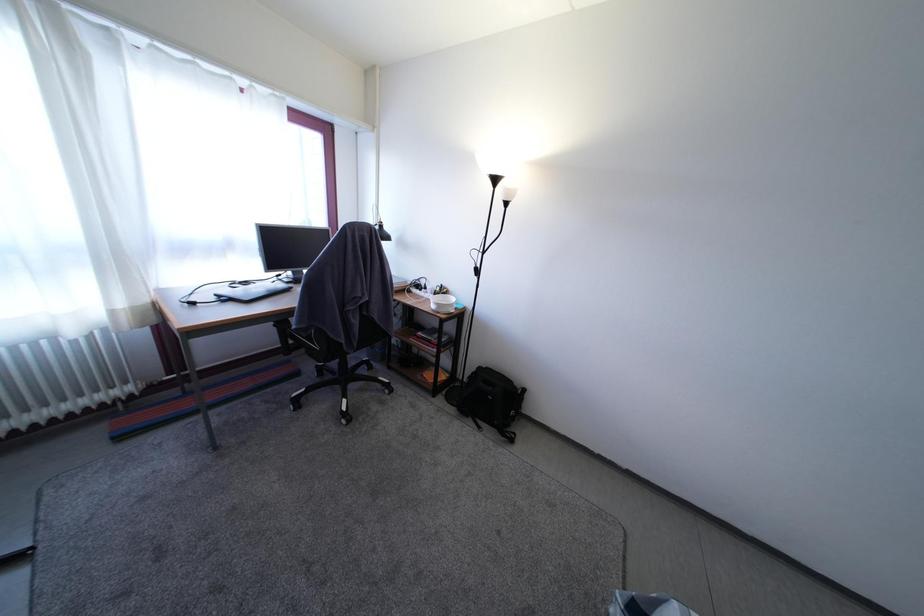
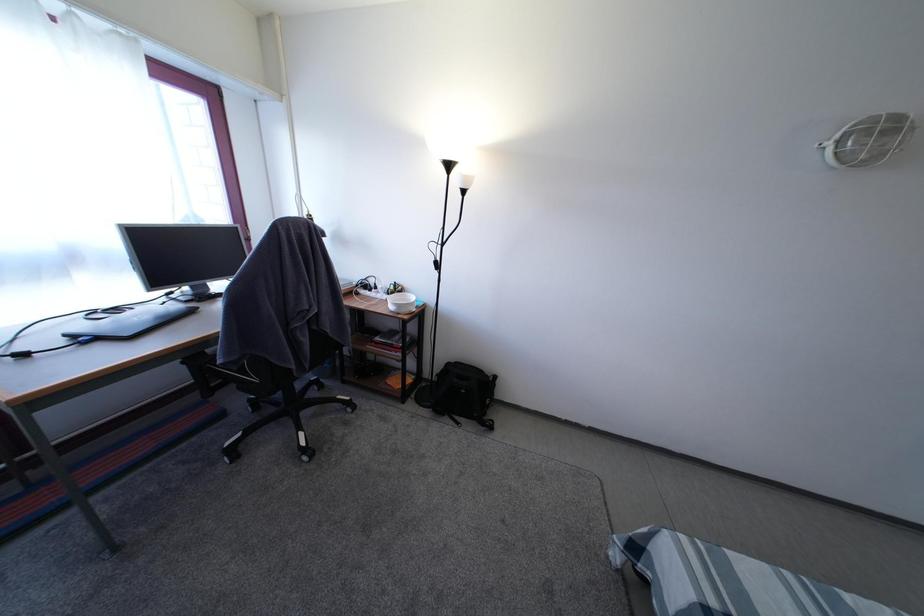
Question: Based on the continuous images, in which direction is the camera rotating? Reply with the corresponding letter.

Choices:
 (A) Left
 (B) Right
 (C) Up
 (D) Down

Answer: (B)